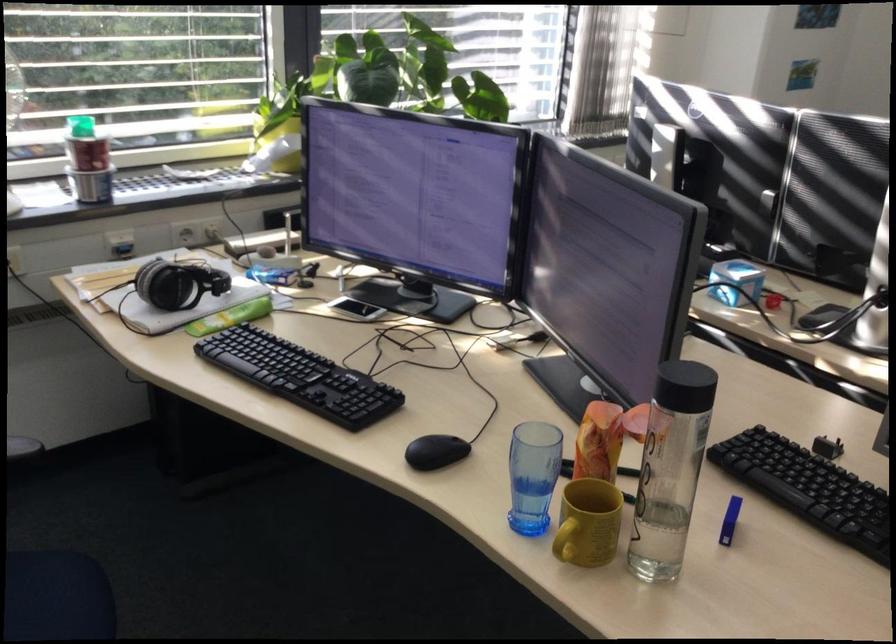
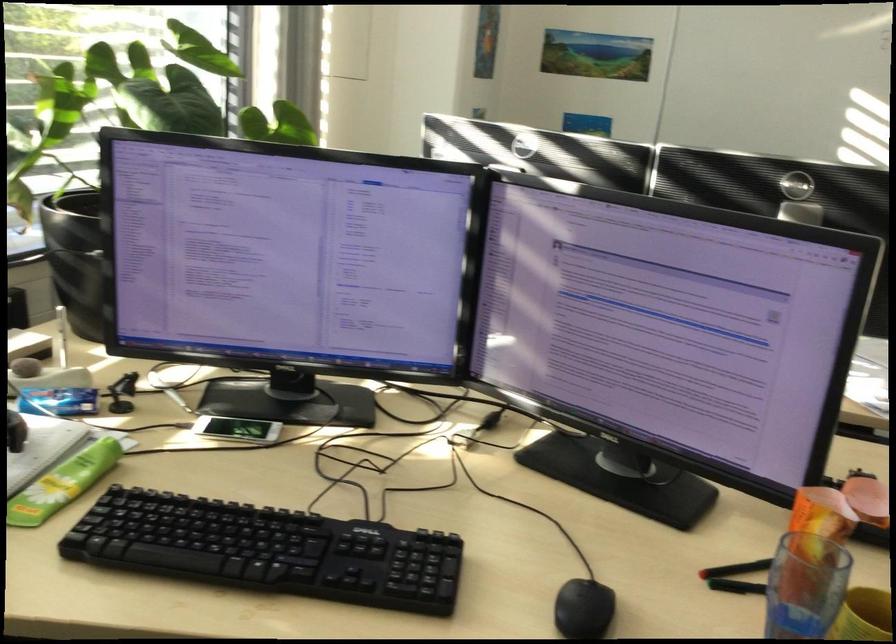
Find the pixel in the second image that matches the point at 320,395 in the first image.

(350, 578)